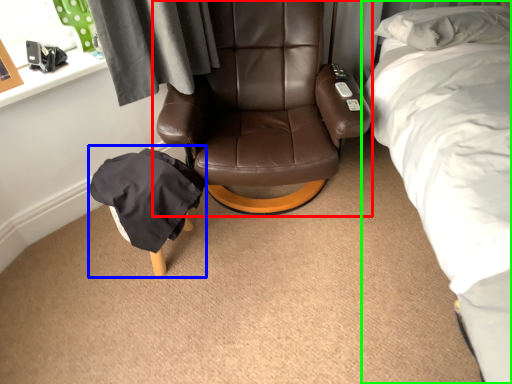
Question: Which is farther away from chair (highlighted by a red box)? bean bag chair (highlighted by a blue box) or bed (highlighted by a green box)?

Choices:
 (A) bean bag chair
 (B) bed

Answer: (B)